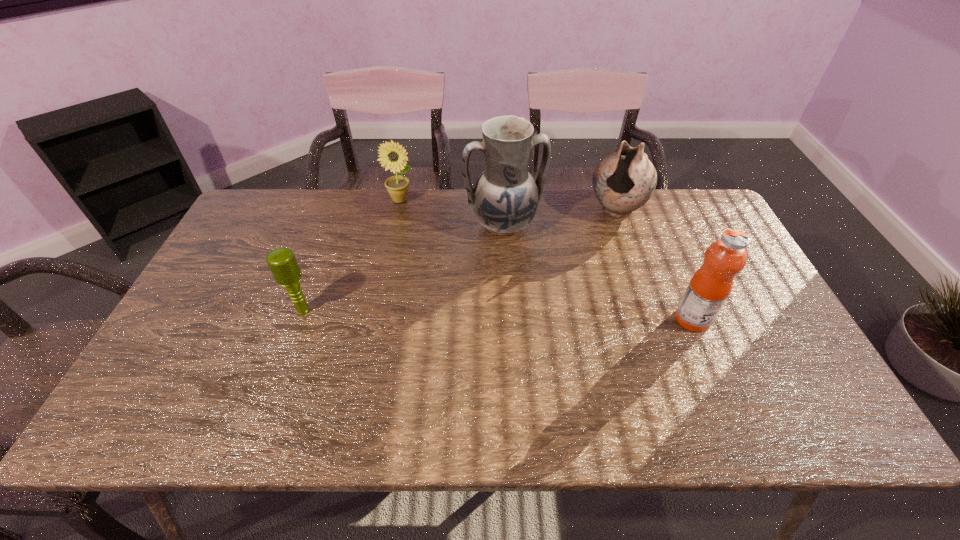
The width and height of the screenshot is (960, 540). Find the location of `vacant space located 0.280m on the front-facing side of the tallest object`. vacant space located 0.280m on the front-facing side of the tallest object is located at coordinates (543, 315).

Locate an element on the screen. vacant space located 0.370m on the face of the second object from left to right is located at coordinates (458, 275).

Find the location of a particular element. This screenshot has height=540, width=960. vacant region located on the face of the second object from left to right is located at coordinates (449, 264).

This screenshot has height=540, width=960. Identify the location of free region located on the face of the second object from left to right. [416, 219].

At what (x,y) coordinates should I click in order to perform the action: click on vacant region located 0.110m from the spout of the pottery. Please return your answer as a coordinate pair (x, y). Looking at the image, I should click on (592, 245).

This screenshot has width=960, height=540. I want to click on free spot located from the spout of the pottery, so click(569, 280).

At what (x,y) coordinates should I click in order to perform the action: click on blank space located 0.210m from the spout of the pottery. Please return your answer as a coordinate pair (x, y). The height and width of the screenshot is (540, 960). Looking at the image, I should click on (580, 265).

This screenshot has width=960, height=540. I want to click on pitcher present at the far edge, so click(x=505, y=198).

This screenshot has height=540, width=960. In order to click on sunflower that is at the far edge in this screenshot , I will do `click(392, 156)`.

Image resolution: width=960 pixels, height=540 pixels. In order to click on pottery that is at the far edge in this screenshot , I will do `click(624, 181)`.